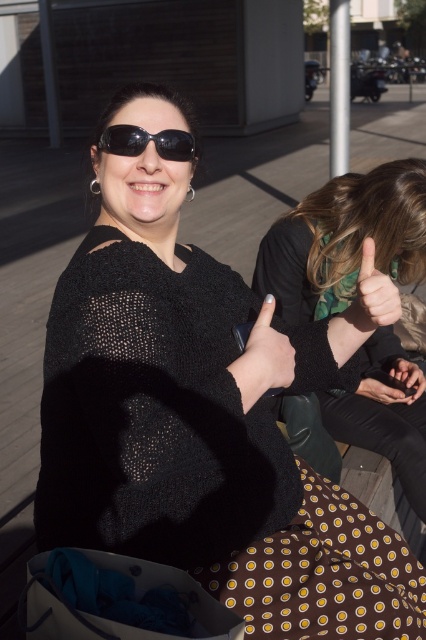
Is matte black hand at upper right wider than smooth skin hand at lower right?

In fact, matte black hand at upper right might be narrower than smooth skin hand at lower right.

Can you confirm if matte black hand at upper right is shorter than smooth skin hand at lower right?

No, matte black hand at upper right is not shorter than smooth skin hand at lower right.

Which is behind, point (370, 307) or point (391, 374)?

Point (391, 374)

Where is `matte black hand at upper right`? matte black hand at upper right is located at coordinates (373, 296).

This screenshot has width=426, height=640. What do you see at coordinates (373, 296) in the screenshot? I see `matte black hand at upper right` at bounding box center [373, 296].

Who is taller, matte black hand at upper right or matte black hand at lower right?

matte black hand at upper right is taller.

Is point (354, 301) positioned after point (382, 401)?

No, (354, 301) is closer to viewer.

Identify the location of matte black hand at upper right. This screenshot has height=640, width=426. (373, 296).

Is matte black hand at center thinner than smooth skin hand at lower right?

Incorrect, matte black hand at center's width is not less than smooth skin hand at lower right's.

Which is in front, point (267, 307) or point (414, 365)?

Positioned in front is point (267, 307).

Where is `matte black hand at center`? matte black hand at center is located at coordinates (264, 358).